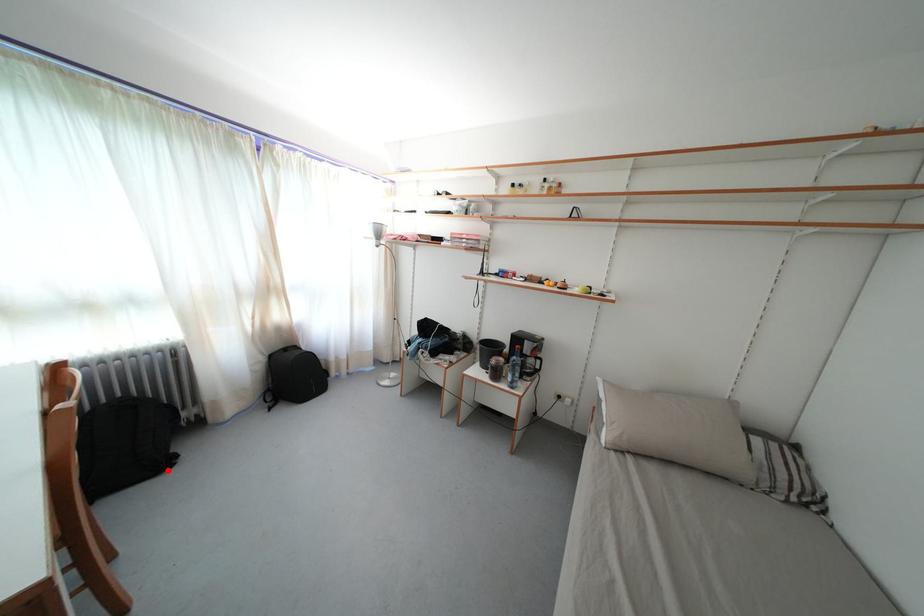
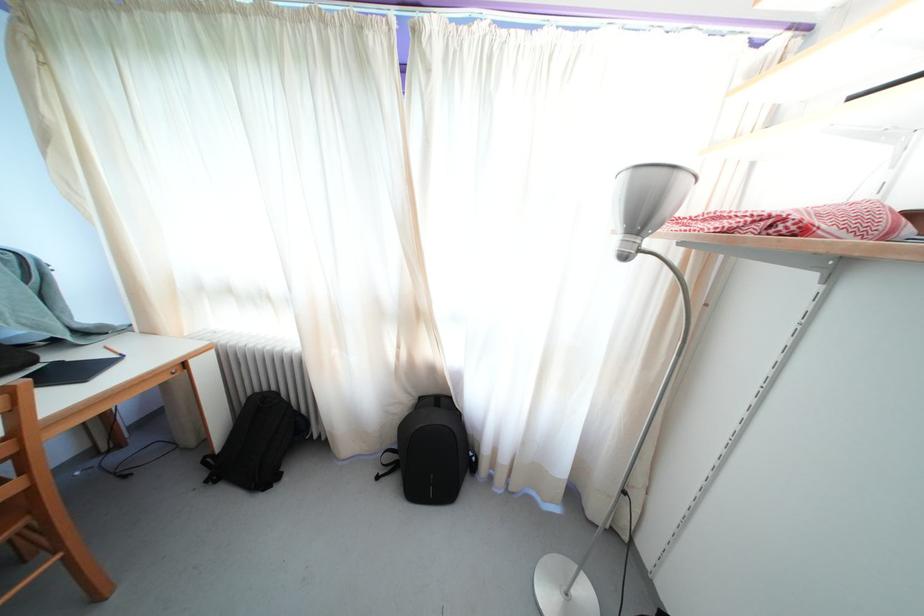
Where in the second image is the point corresponding to the highlighted location from the first image?

(271, 485)